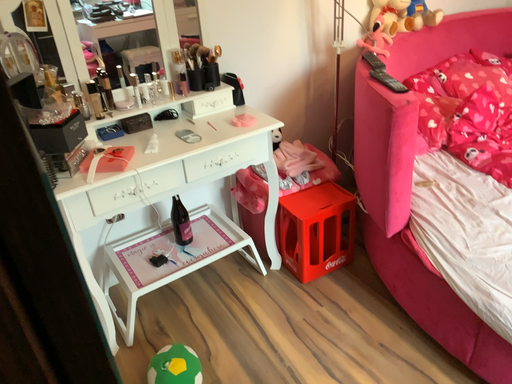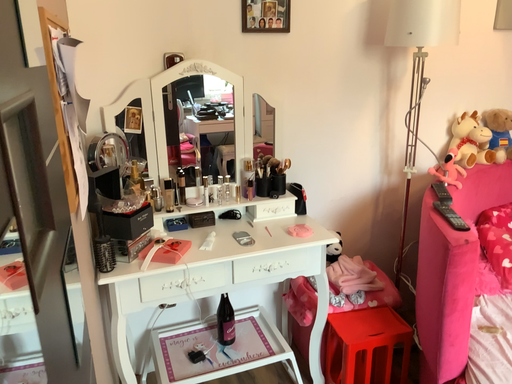
Question: How did the camera likely rotate when shooting the video?

Choices:
 (A) rotated right
 (B) rotated left

Answer: (B)